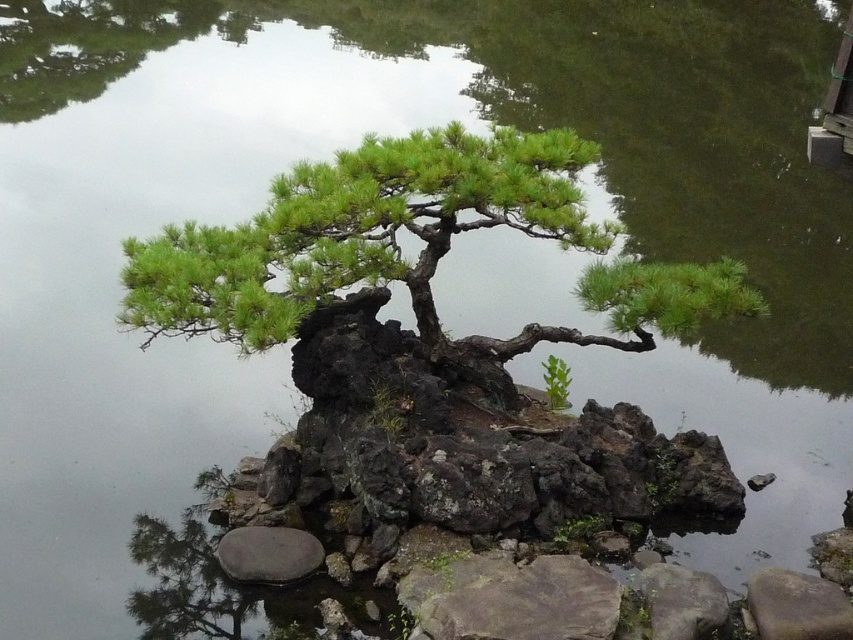
In the scene shown: You are a gardener who wants to place a new decorative item in the scene. The gray rough stone at lower right is located at coordinates 0.948, 0.936. If you want to place the item 0.1 units to the left of this stone, what coordinate would that be?

The new coordinate would be 0.948 minus 0.1 equals 0.848, so the coordinate is [798,541].

You are a gardener observing the bonsai arrangement. You need to place a small decorative pebble between the gray rough rock at lower right and the smooth gray stone at lower left. Based on their positions, where should you place the pebble to ensure it sits between them?

The gray rough rock at lower right is below the smooth gray stone at lower left, so placing the pebble between them would require positioning it above the gray rough rock at lower right and below the smooth gray stone at lower left.

You are a gardener who wants to place a new small potted plant between the gray rough stone at lower right and the smooth gray stone at lower left. Based on their sizes, which stone should the plant be closer to?

The gray rough stone at lower right is larger in size than the smooth gray stone at lower left, so the plant should be placed closer to the smooth gray stone at lower left to balance the composition.